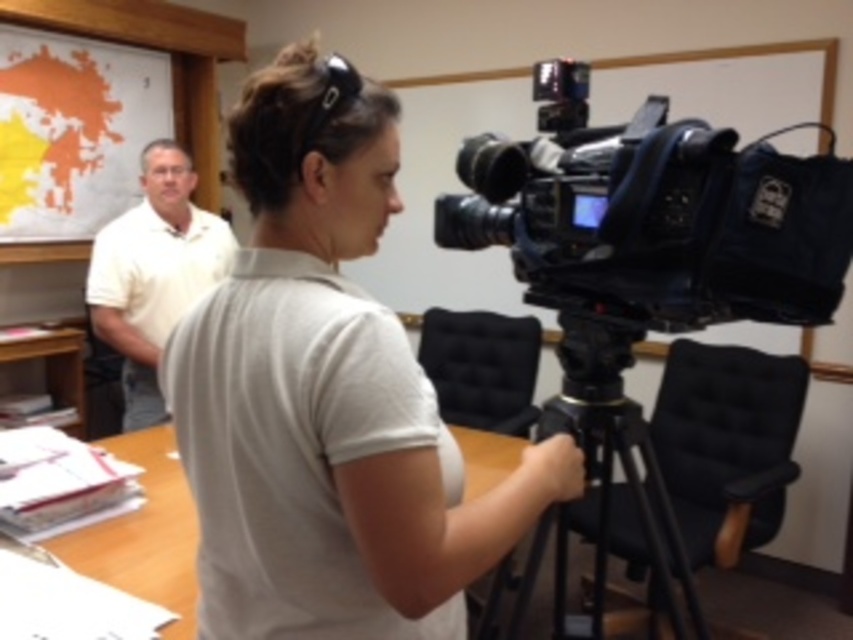
How far apart are black plastic video camera at center and black plastic camera at center?

black plastic video camera at center and black plastic camera at center are 10.26 centimeters apart.

Is black plastic video camera at center to the right of black plastic camera at center from the viewer's perspective?

Incorrect, black plastic video camera at center is not on the right side of black plastic camera at center.

Who is more forward, (694, 259) or (486, 172)?

Positioned in front is point (694, 259).

This screenshot has height=640, width=853. Identify the location of black plastic video camera at center. (645, 268).

Is black plastic video camera at center above white cotton shirt at left?

Actually, black plastic video camera at center is below white cotton shirt at left.

This screenshot has width=853, height=640. Describe the element at coordinates (645, 268) in the screenshot. I see `black plastic video camera at center` at that location.

This screenshot has width=853, height=640. I want to click on black plastic video camera at center, so click(645, 268).

Is black plastic camera at center above black metal tripod at center?

Yes.

Who is positioned more to the right, black plastic camera at center or black metal tripod at center?

Positioned to the right is black metal tripod at center.

This screenshot has height=640, width=853. What are the coordinates of `black plastic camera at center` in the screenshot? It's located at (654, 216).

Where is `black plastic camera at center`? This screenshot has width=853, height=640. black plastic camera at center is located at coordinates (654, 216).